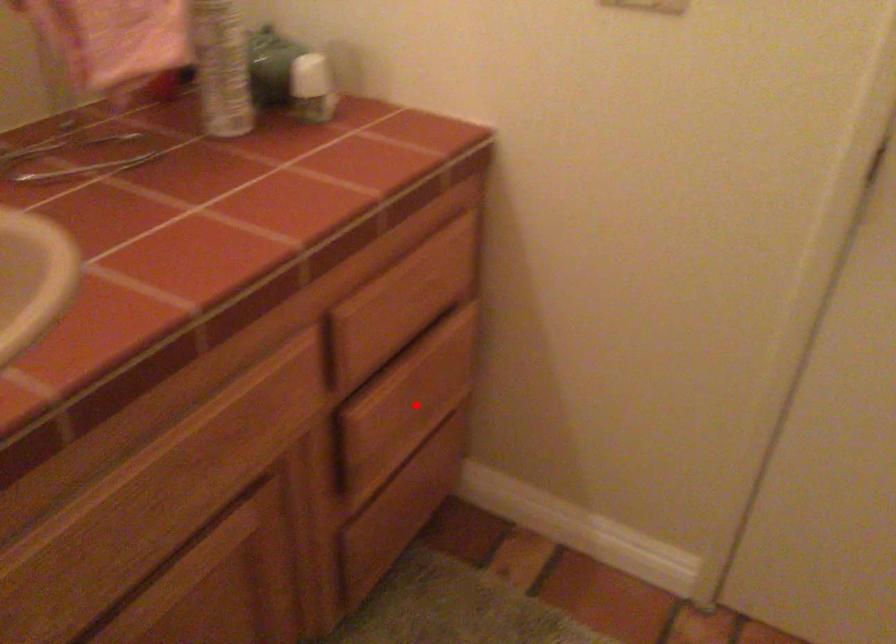
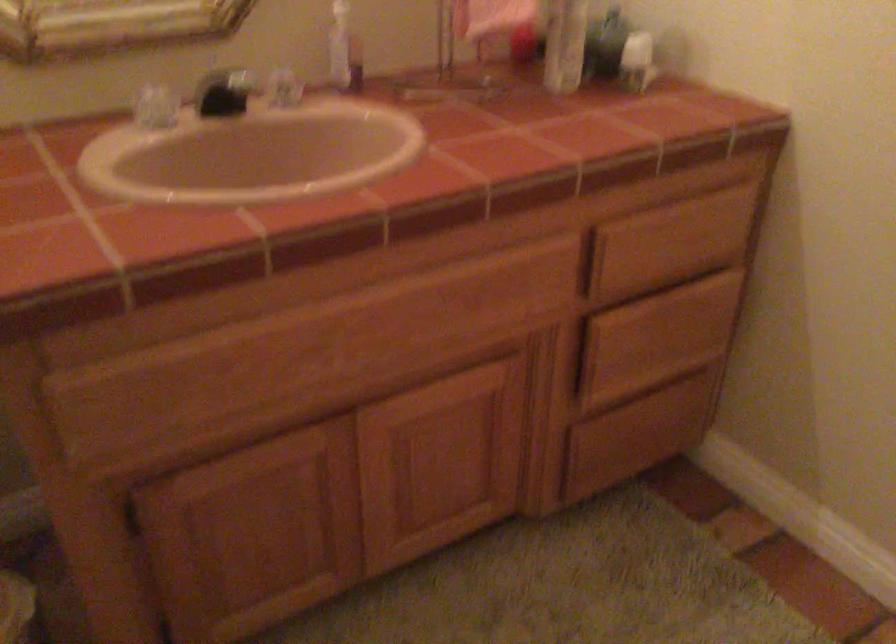
Question: I am providing you with two images of the same scene from different viewpoints. A red point is shown in image1. For the corresponding object point in image2, is it positioned nearer or farther from the camera?

Choices:
 (A) Nearer
 (B) Farther

Answer: (B)